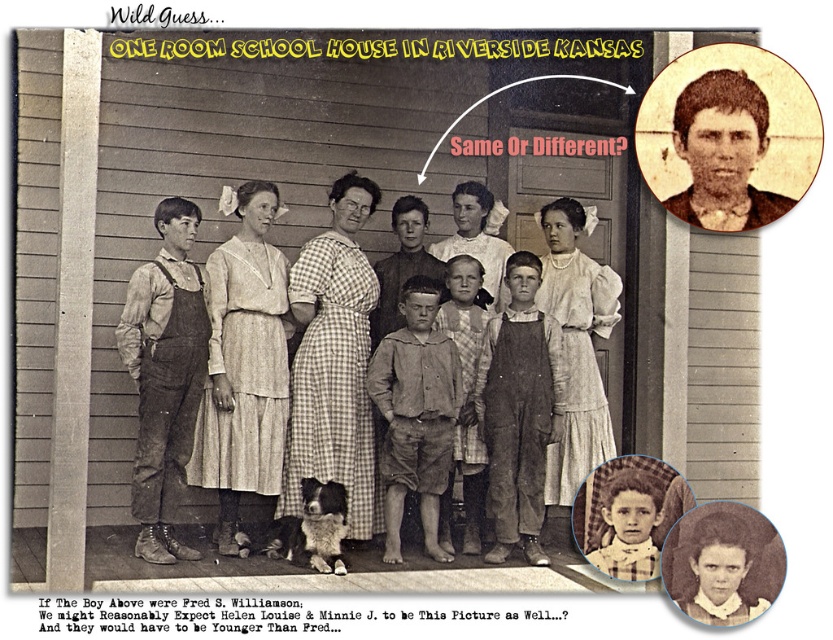
You are a photographer examining this historical image. You notice two central figures wearing a checkered fabric dress at center and overalls at center. Which of these two is closer to the camera?

The checkered fabric dress at center is closer to the camera than the overalls at center because it is further to the viewer according to the description.

You are a photographer from the early 20th century trying to capture a group photo of the children and adults outside the schoolhouse. You notice two subjects in the center of the image, a checkered fabric dress at center and overalls at center. How far apart are these two subjects in centimeters?

The checkered fabric dress at center is 79.96 centimeters from the overalls at center, so the two subjects are 79.96 centimeters apart.

You are a tailor in 1900 observing this historical photograph. You need to determine which garment requires more fabric to create between the checkered fabric dress at center and the overalls at center. Which one would you choose?

The checkered fabric dress at center has a larger size compared to overalls at center, so it would require more fabric to create.